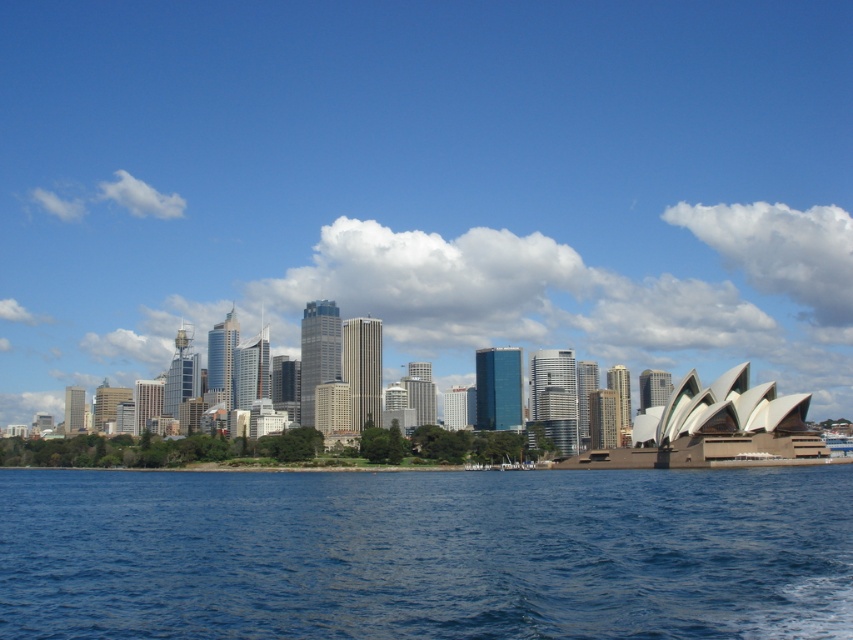
Question: Can you confirm if transparent glass skyline at center is positioned above blue water at lower center?

Choices:
 (A) yes
 (B) no

Answer: (A)

Question: Among these objects, which one is nearest to the camera?

Choices:
 (A) blue water at lower center
 (B) transparent glass skyline at center

Answer: (A)

Question: Is transparent glass skyline at center closer to the viewer compared to blue water at lower center?

Choices:
 (A) yes
 (B) no

Answer: (B)

Question: Can you confirm if transparent glass skyline at center is positioned to the left of blue water at lower center?

Choices:
 (A) no
 (B) yes

Answer: (A)